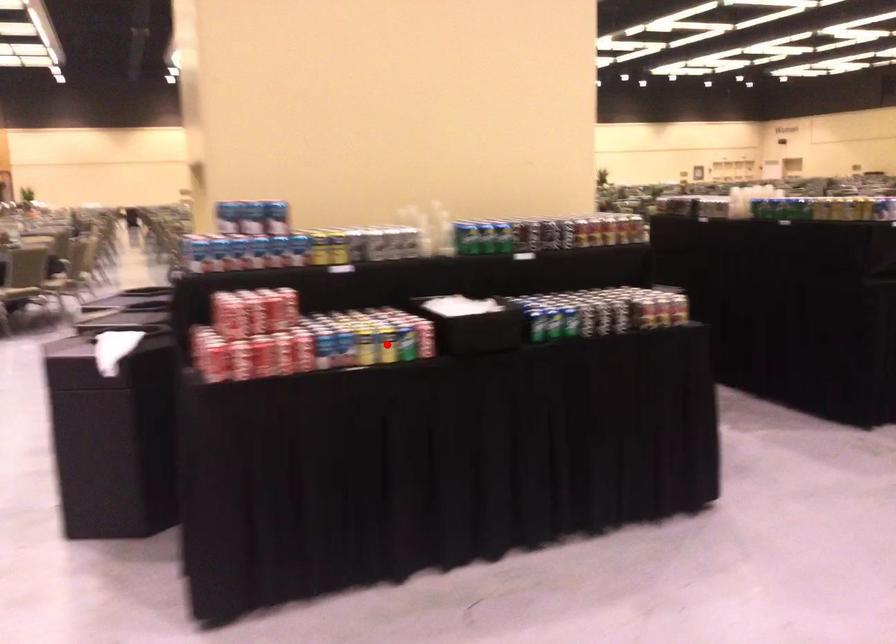
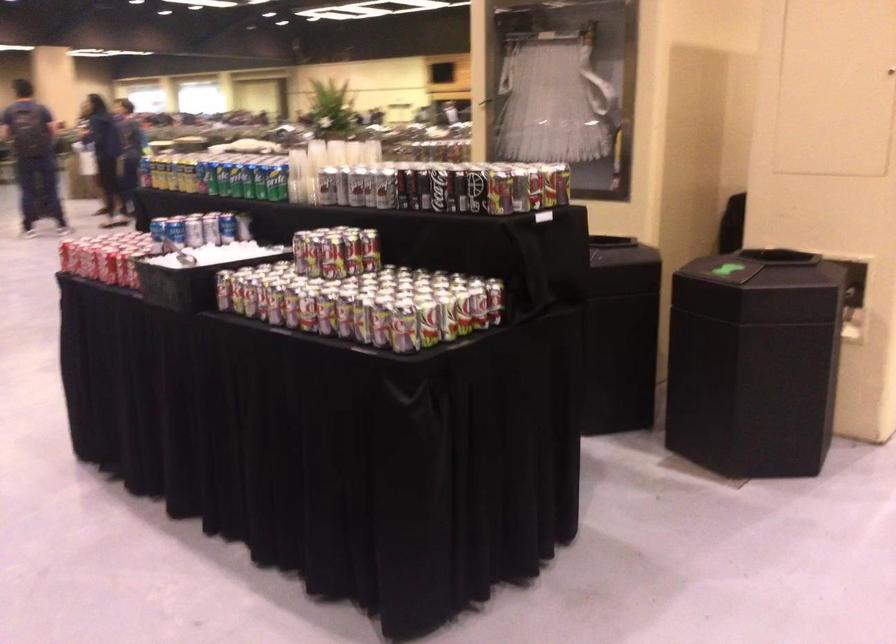
Question: I am providing you with two images of the same scene from different viewpoints. A red point is marked on the first image. Can you still see the location of the red point in image 2?

Choices:
 (A) Yes
 (B) No

Answer: (B)